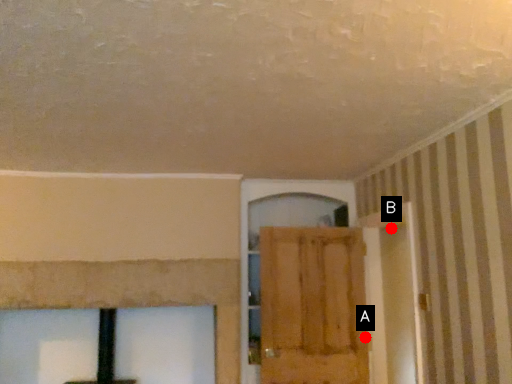
Question: Two points are circled on the image, labeled by A and B beside each circle. Which point appears farthest from the camera in this image?

Choices:
 (A) A is further
 (B) B is further

Answer: (B)